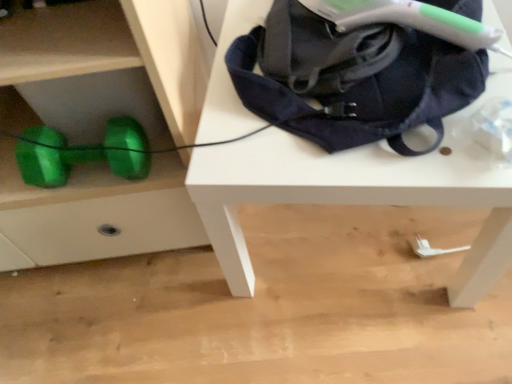
Question: Is navy blue fabric bag at upper right to the left of white matte table at upper center from the viewer's perspective?

Choices:
 (A) no
 (B) yes

Answer: (B)

Question: Is navy blue fabric bag at upper right oriented away from white matte table at upper center?

Choices:
 (A) yes
 (B) no

Answer: (B)

Question: Is navy blue fabric bag at upper right outside white matte table at upper center?

Choices:
 (A) no
 (B) yes

Answer: (B)

Question: Does navy blue fabric bag at upper right have a larger size compared to white matte table at upper center?

Choices:
 (A) yes
 (B) no

Answer: (B)

Question: Are navy blue fabric bag at upper right and white matte table at upper center beside each other?

Choices:
 (A) no
 (B) yes

Answer: (A)

Question: From a real-world perspective, is green shiny dumbbell at lower left positioned above or below white matte table at upper center?

Choices:
 (A) below
 (B) above

Answer: (B)

Question: Considering their positions, is green shiny dumbbell at lower left located in front of or behind white matte table at upper center?

Choices:
 (A) behind
 (B) front

Answer: (B)

Question: From the image's perspective, is green shiny dumbbell at lower left above or below white matte table at upper center?

Choices:
 (A) below
 (B) above

Answer: (B)

Question: From their relative heights in the image, would you say green shiny dumbbell at lower left is taller or shorter than white matte table at upper center?

Choices:
 (A) tall
 (B) short

Answer: (A)

Question: Considering the positions of green shiny dumbbell at lower left and green metallic dumbbell at lower left in the image, is green shiny dumbbell at lower left wider or thinner than green metallic dumbbell at lower left?

Choices:
 (A) thin
 (B) wide

Answer: (B)

Question: From their relative heights in the image, would you say green shiny dumbbell at lower left is taller or shorter than green metallic dumbbell at lower left?

Choices:
 (A) short
 (B) tall

Answer: (B)

Question: Is point (140, 233) closer or farther from the camera than point (141, 147)?

Choices:
 (A) closer
 (B) farther

Answer: (B)

Question: Based on their positions, is green shiny dumbbell at lower left located to the left or right of green metallic dumbbell at lower left?

Choices:
 (A) right
 (B) left

Answer: (B)

Question: Relative to white matte table at upper center, is green metallic dumbbell at lower left in front or behind?

Choices:
 (A) behind
 (B) front

Answer: (A)

Question: From the image's perspective, relative to white matte table at upper center, is green metallic dumbbell at lower left above or below?

Choices:
 (A) above
 (B) below

Answer: (B)